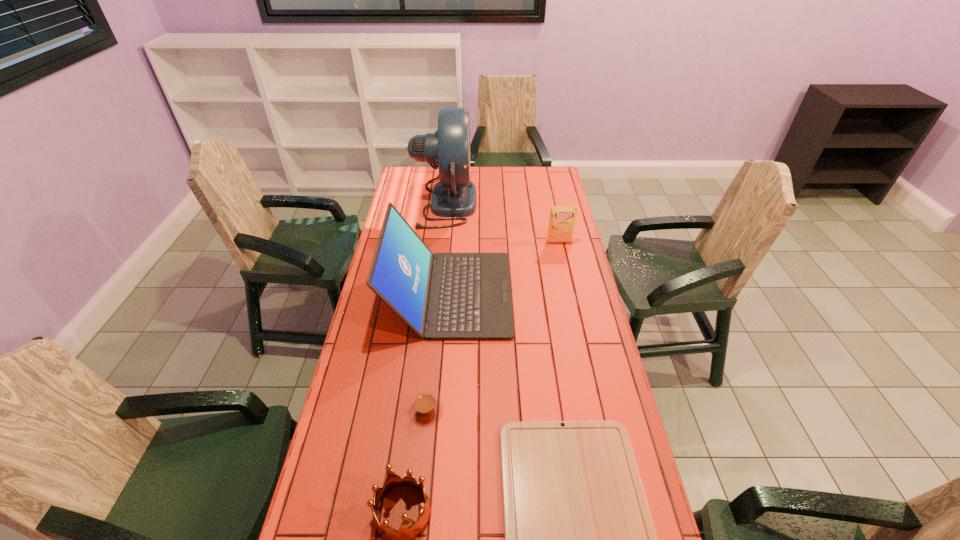
At what (x,y) coordinates should I click in order to perform the action: click on vacant space located 0.400m on the right of the cappuccino. Please return your answer as a coordinate pair (x, y). Image resolution: width=960 pixels, height=540 pixels. Looking at the image, I should click on (583, 411).

This screenshot has width=960, height=540. Find the location of `object that is at the far edge`. object that is at the far edge is located at coordinates (454, 197).

You are a GUI agent. You are given a task and a screenshot of the screen. Output one action in this format:
    pyautogui.click(x=<x>, y=<y>)
    Task: Click on the fan located in the left edge section of the desktop
    Image resolution: width=960 pixels, height=540 pixels.
    Given the screenshot: What is the action you would take?
    pyautogui.click(x=454, y=197)

At what (x,y) coordinates should I click in order to perform the action: click on laptop computer at the left edge. Please return your answer as a coordinate pair (x, y). The image size is (960, 540). Looking at the image, I should click on coord(444,296).

Find the location of a particular element. object that is at the right edge is located at coordinates (562, 220).

Where is `object that is at the far left corner`? object that is at the far left corner is located at coordinates (454, 197).

Identify the location of vacant point at the far edge. The height and width of the screenshot is (540, 960). (506, 179).

The height and width of the screenshot is (540, 960). In the image, there is a desktop. Find the location of `free space at the left edge`. free space at the left edge is located at coordinates (393, 334).

Locate an element on the screen. vacant space at the right edge of the desktop is located at coordinates (599, 326).

Locate an element on the screen. The width and height of the screenshot is (960, 540). free space at the far left corner of the desktop is located at coordinates (416, 180).